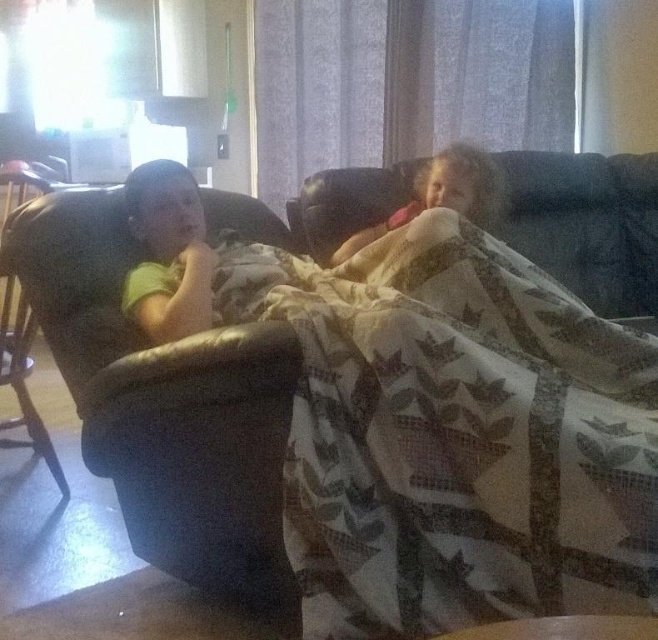
You are planning to place a new rectangular coffee table in the living room. The coffee table is 1.2 meters wide. You want to position it between the soft pink blanket at center and the black leather chair at left. Based on their widths, will the space between them accommodate the coffee table?

The soft pink blanket at center is wider than the black leather chair at left. However, the question is about the space between them accommodating a coffee table based on their widths. Since the description only provides information about their widths relative to each other and not the actual distance between them, we cannot determine if the 1.2 meter wide coffee table will fit. More information about the distance between the two objects is needed to answer this accurately.

You are a delivery person trying to place a small package between the matte green shirt at left and the black leather chair at left. Can you fit the package if it measures 18 inches in length?

The distance between the matte green shirt at left and the black leather chair at left is 17.72 inches. Since the package is 18 inches long, it cannot fit in the space provided.

You are a photographer setting up a shoot in the living room. You need to position a camera on a tripod between the matte green shirt at left and the black leather chair at left. Can you place the camera directly in between them without it being blocked?

The matte green shirt at left is in front of the black leather chair at left, so placing the camera directly between them would require positioning it behind the matte green shirt at left to avoid blocking. However, since the shirt is in front, the camera might be blocked unless moved further back.